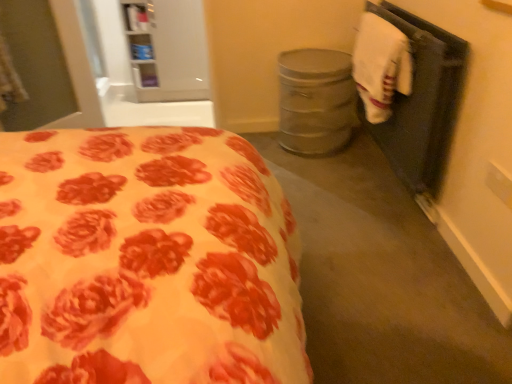
At what (x,y) coordinates should I click in order to perform the action: click on free location in front of white fabric at right. Please return your answer as a coordinate pair (x, y). Looking at the image, I should click on (374, 248).